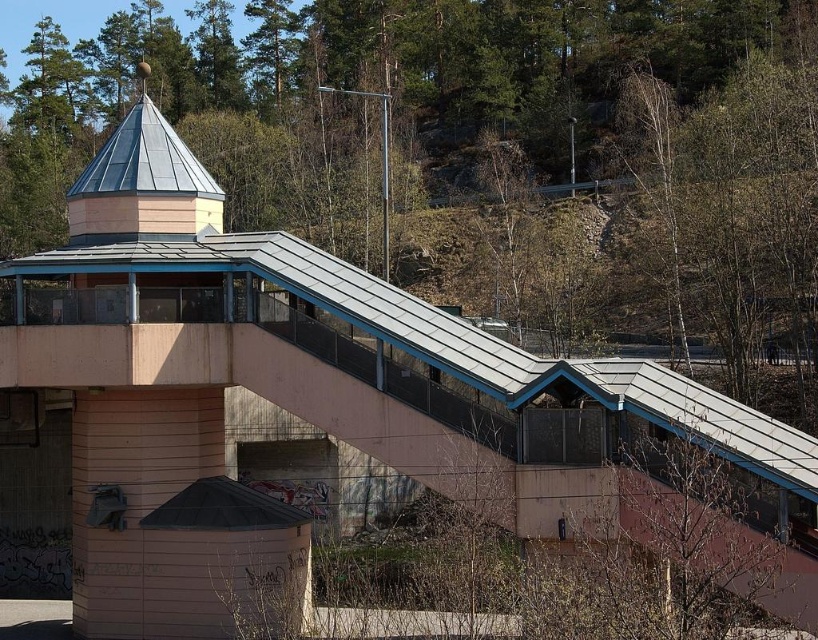
Between point (348, 17) and point (70, 186), which one is positioned behind?

The point (348, 17) is more distant.

Can you confirm if green leafy tree at center is positioned above metallic silver spire at upper center?

Indeed, green leafy tree at center is positioned over metallic silver spire at upper center.

The height and width of the screenshot is (640, 818). What do you see at coordinates (488, 147) in the screenshot?
I see `green leafy tree at center` at bounding box center [488, 147].

The width and height of the screenshot is (818, 640). Identify the location of green leafy tree at center. (488, 147).